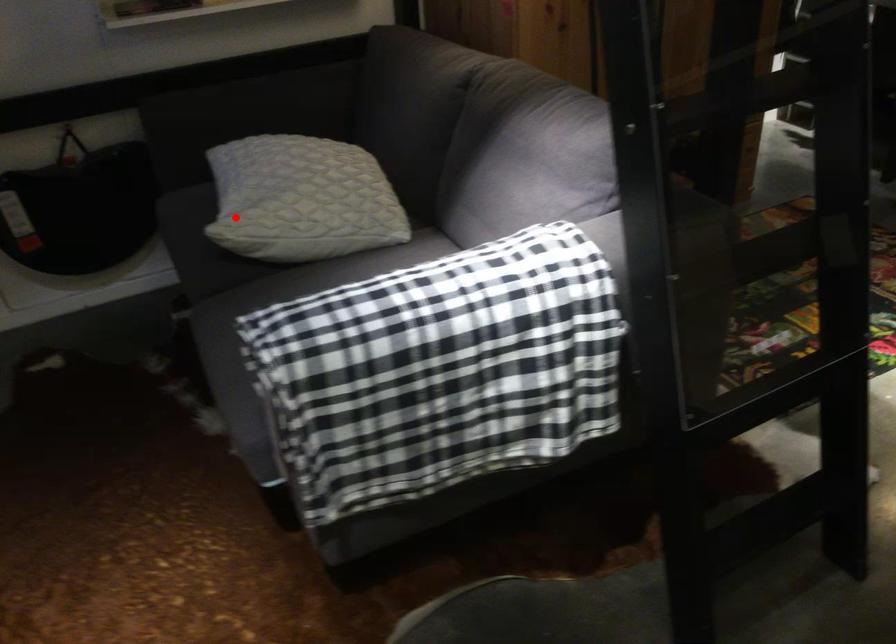
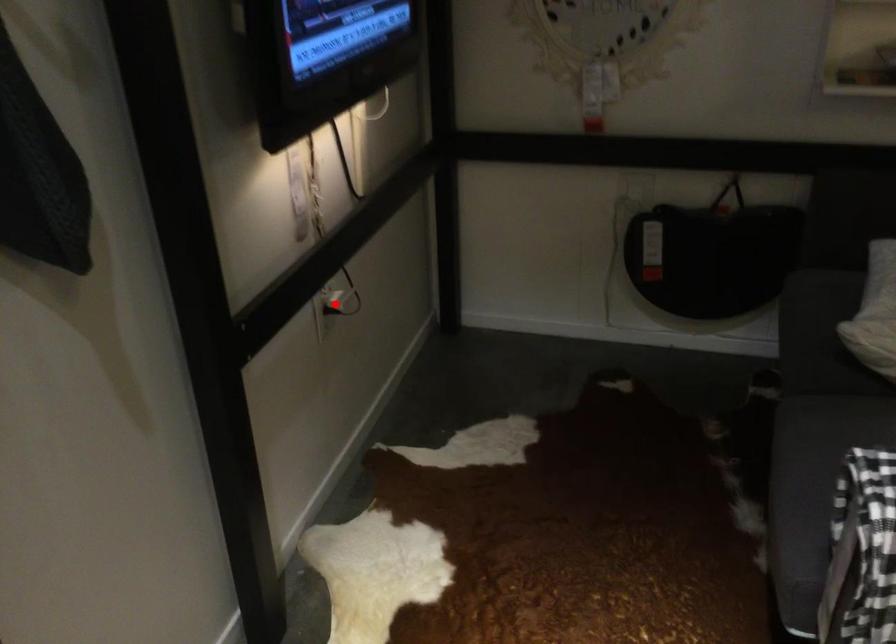
I am providing you with two images of the same scene from different viewpoints. A red point is marked on the first image and another point is marked on the second image. Do the highlighted points in image1 and image2 indicate the same real-world spot?

No